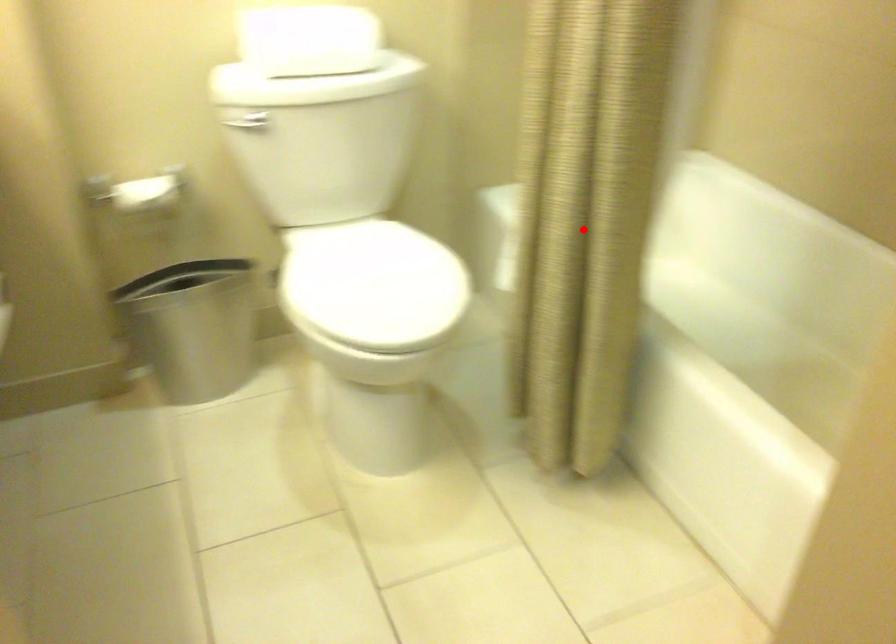
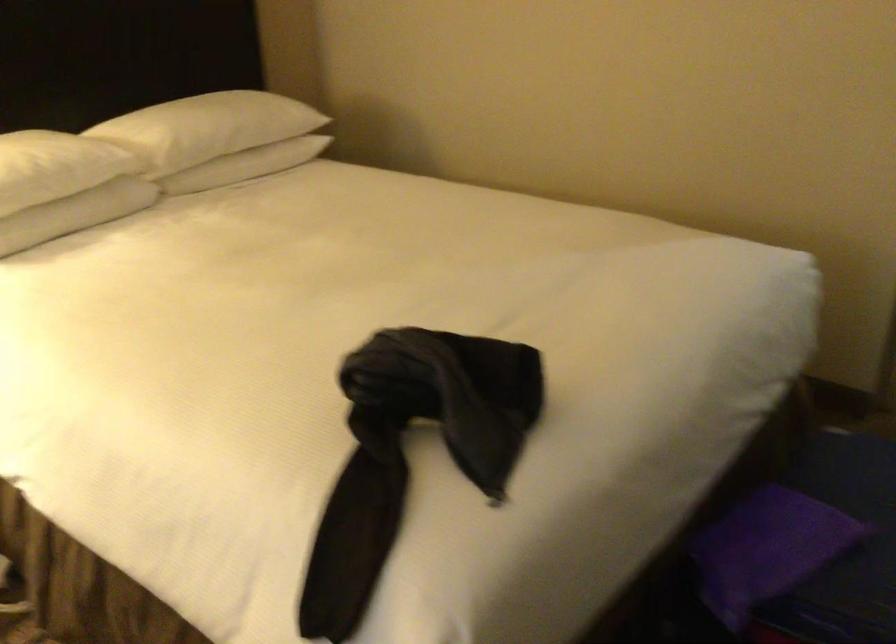
Question: I am providing you with two images of the same scene from different viewpoints. A red point is marked on the first image. Can you still see the location of the red point in image 2?

Choices:
 (A) Yes
 (B) No

Answer: (B)